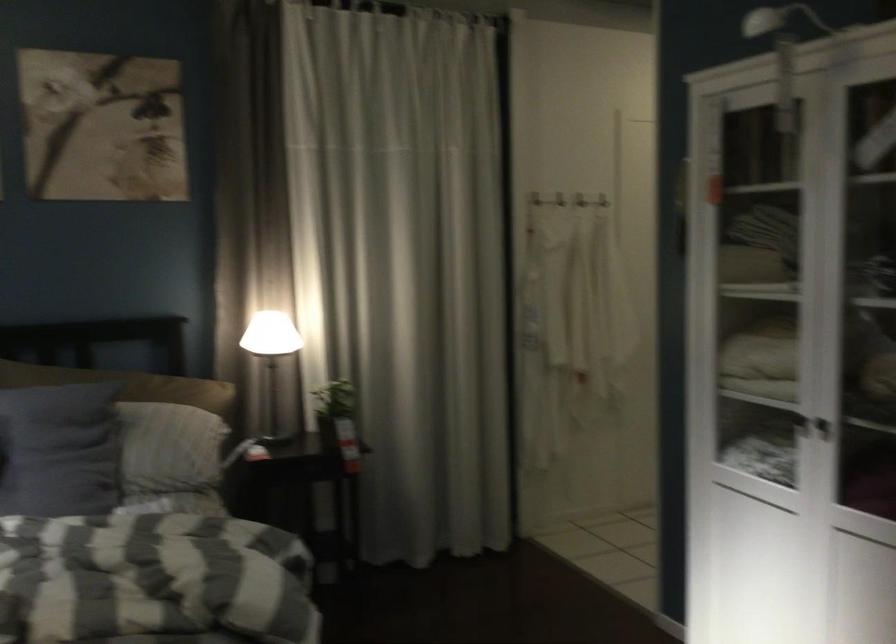
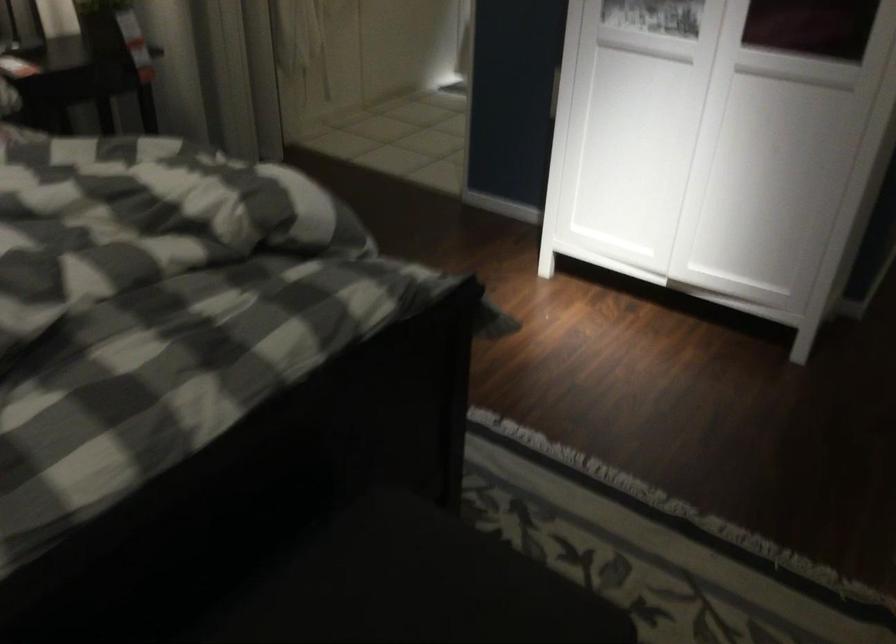
The images are taken continuously from a first-person perspective. In which direction is your viewpoint rotating?

The camera rotated toward right-down.